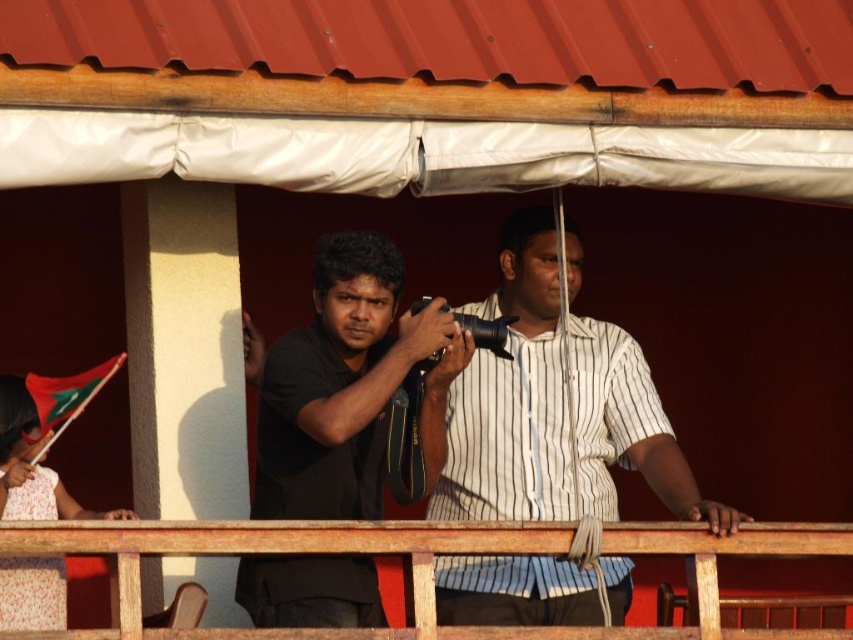
Question: Observing the image, what is the correct spatial positioning of black matte camera at center in reference to wooden at center?

Choices:
 (A) right
 (B) left

Answer: (B)

Question: Which point is farther to the camera?

Choices:
 (A) (457, 602)
 (B) (227, 545)
 (C) (283, 454)

Answer: (A)

Question: Which point is closer to the camera taking this photo?

Choices:
 (A) (239, 532)
 (B) (482, 413)
 (C) (320, 374)

Answer: (A)

Question: Among these points, which one is farthest from the camera?

Choices:
 (A) (285, 557)
 (B) (660, 492)
 (C) (744, 541)

Answer: (B)

Question: Can you confirm if white striped shirt at center is positioned above wooden at center?

Choices:
 (A) no
 (B) yes

Answer: (B)

Question: Does white striped shirt at center appear on the right side of wooden at center?

Choices:
 (A) yes
 (B) no

Answer: (B)